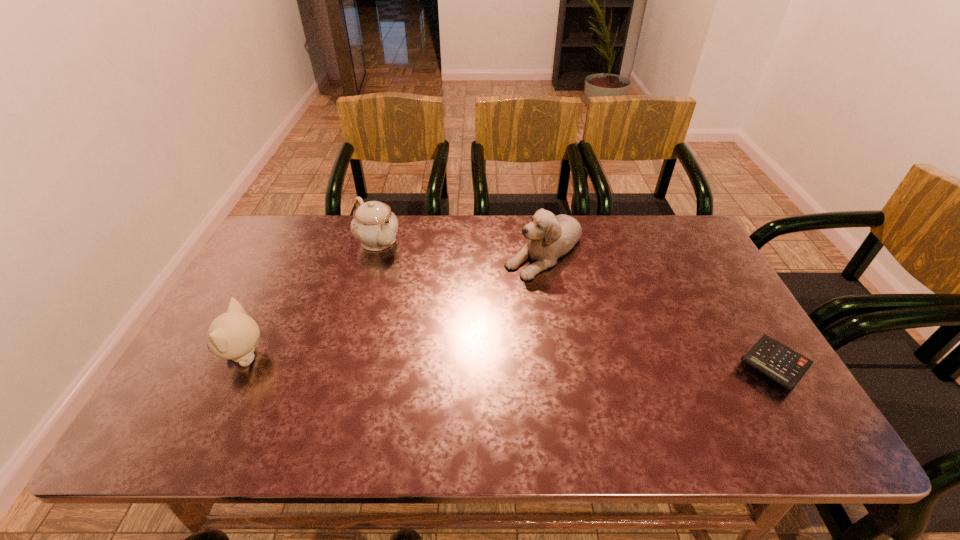
Locate an element on the screen. vacant space that satisfies the following two spatial constraints: 1. on the front side of the calculator; 2. on the right side of the chinaware is located at coordinates (343, 366).